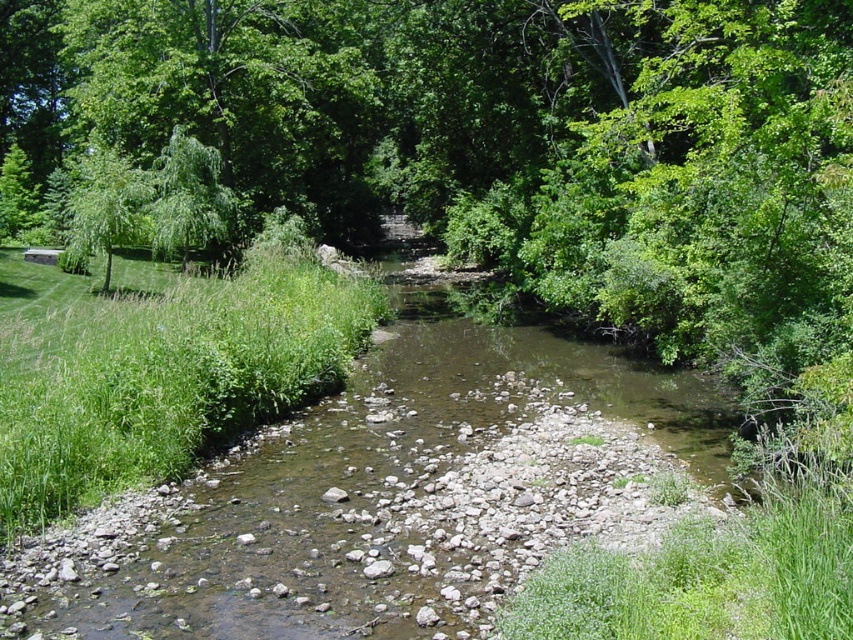
You are standing at the point labeled as point (170, 381) in the image. What do you see around you?

You are standing on green grass at left, as the point (170, 381) corresponds to green grass at left.

Looking at this image, you are standing at the origin point of the image. Which direction should you move to reach the green grass at left?

The green grass at left is located at point 0.597 on the x axis and 0.200 on the y axis. Since the origin is at the bottom left corner of the image, you should move to the right and slightly upward to reach the green grass at left.

You are a gardener planning to mow the green grass at left and trim the green leafy tree at left. Based on their sizes, which task would require more time and effort?

The green leafy tree at left requires more time and effort to trim because it occupies more space than the green grass at left.